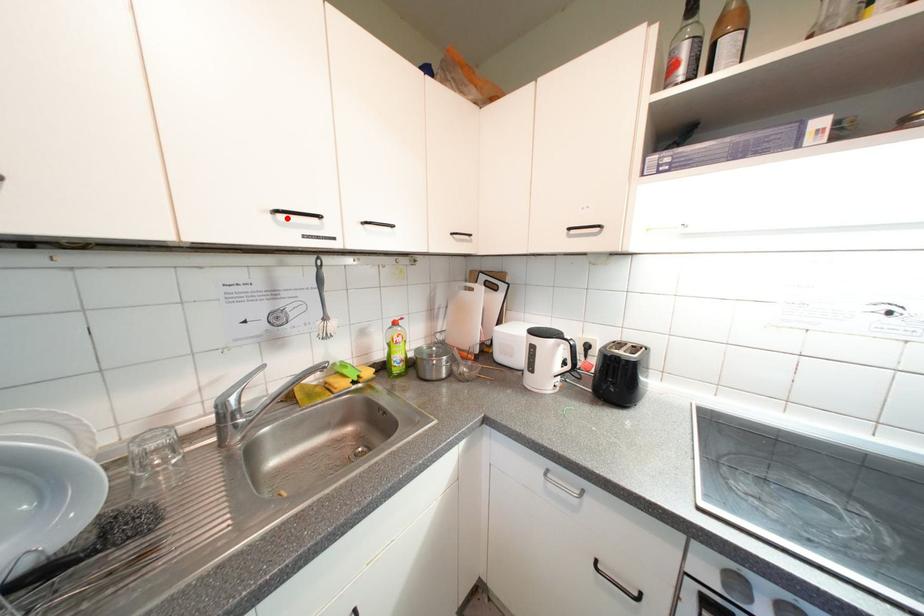
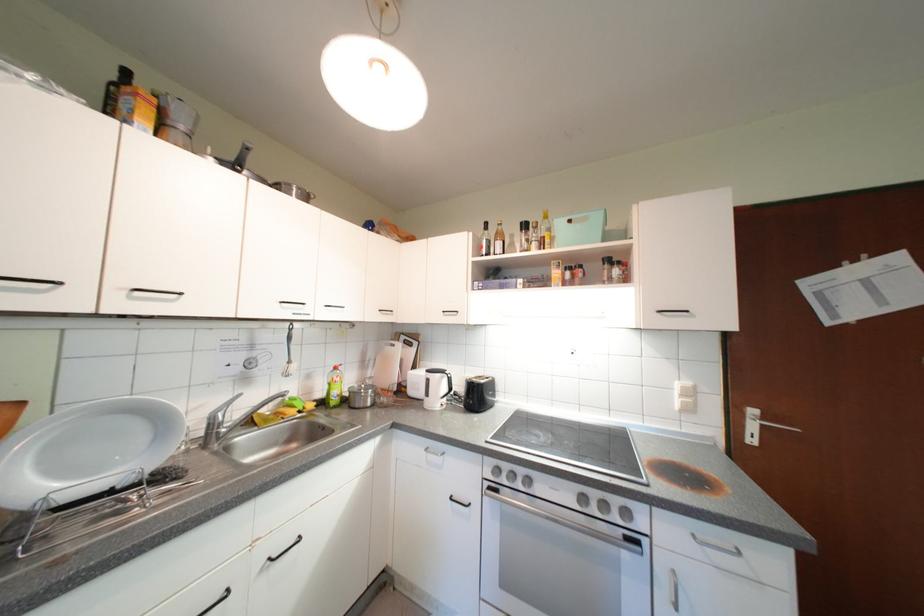
Question: I am providing you with two images of the same scene from different viewpoints. A red point is marked on the first image. Can you still see the location of the red point in image 2?

Choices:
 (A) Yes
 (B) No

Answer: (A)